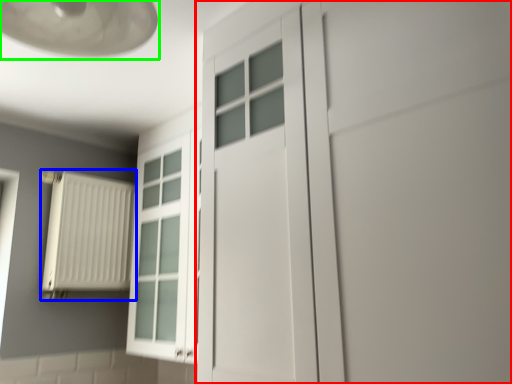
Question: Considering the real-world distances, which object is closest to door (highlighted by a red box)? radiator (highlighted by a blue box) or lamp (highlighted by a green box).

Choices:
 (A) radiator
 (B) lamp

Answer: (B)